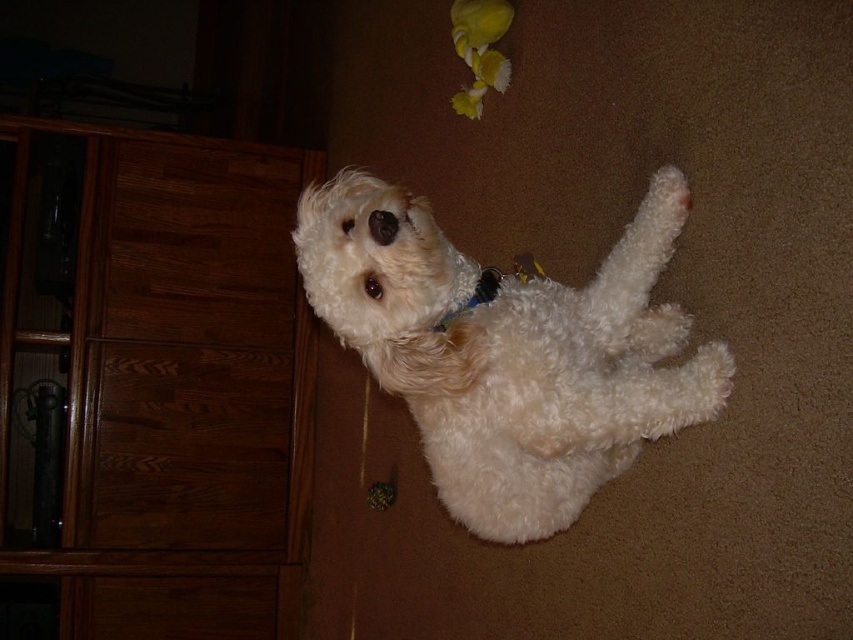
Between point (35, 474) and point (676, 314), which one is positioned behind?

Positioned behind is point (35, 474).

Describe the element at coordinates (154, 380) in the screenshot. I see `brown wood dresser at left` at that location.

The image size is (853, 640). What are the coordinates of `brown wood dresser at left` in the screenshot? It's located at (154, 380).